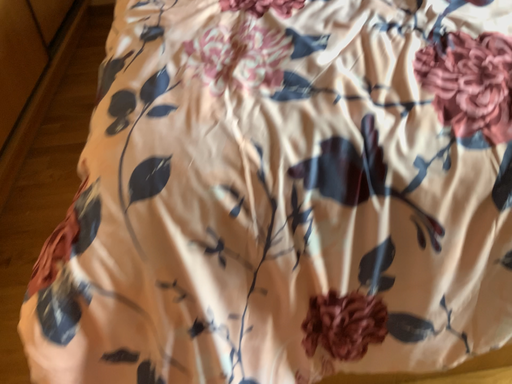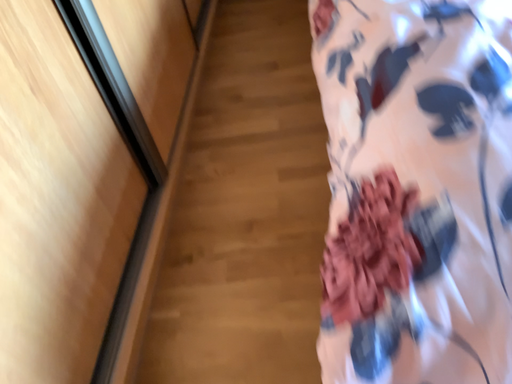
Question: How did the camera likely rotate when shooting the video?

Choices:
 (A) rotated left
 (B) rotated right

Answer: (A)